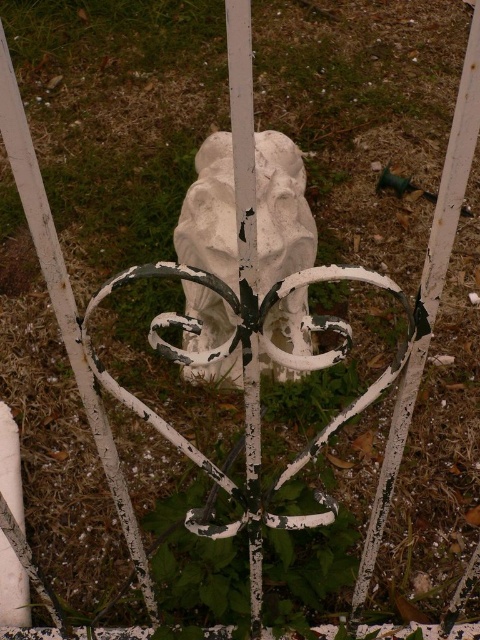
Is white matte stone lion at center shorter than white painted metal pole at center?

Yes, white matte stone lion at center is shorter than white painted metal pole at center.

At what (x,y) coordinates should I click in order to perform the action: click on white matte stone lion at center. Please return your answer as a coordinate pair (x, y). Image resolution: width=480 pixels, height=640 pixels. Looking at the image, I should click on (282, 211).

The image size is (480, 640). What do you see at coordinates (282, 211) in the screenshot? I see `white matte stone lion at center` at bounding box center [282, 211].

Locate an element on the screen. The image size is (480, 640). white matte stone lion at center is located at coordinates (282, 211).